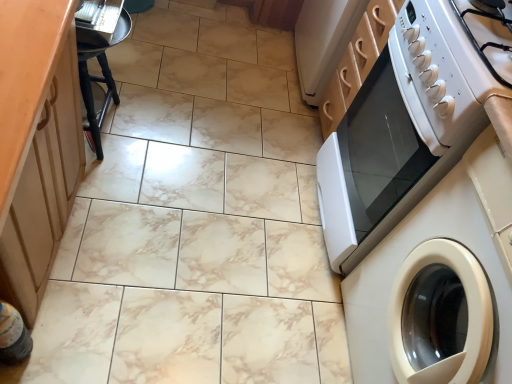
Question: Is white glossy gas stove at upper right oriented towards translucent plastic bottle at lower left?

Choices:
 (A) yes
 (B) no

Answer: (B)

Question: Is white glossy gas stove at upper right far from translucent plastic bottle at lower left?

Choices:
 (A) no
 (B) yes

Answer: (B)

Question: From a real-world perspective, is white glossy gas stove at upper right positioned over translucent plastic bottle at lower left based on gravity?

Choices:
 (A) yes
 (B) no

Answer: (A)

Question: Is white glossy gas stove at upper right further to the viewer compared to translucent plastic bottle at lower left?

Choices:
 (A) yes
 (B) no

Answer: (B)

Question: From the image's perspective, is white glossy gas stove at upper right beneath translucent plastic bottle at lower left?

Choices:
 (A) yes
 (B) no

Answer: (B)

Question: Is white glossy gas stove at upper right in front of translucent plastic bottle at lower left?

Choices:
 (A) no
 (B) yes

Answer: (B)

Question: Can you confirm if wooden cabinet at left is taller than white glossy washing machine at right?

Choices:
 (A) no
 (B) yes

Answer: (A)

Question: Can you confirm if wooden cabinet at left is bigger than white glossy washing machine at right?

Choices:
 (A) no
 (B) yes

Answer: (B)

Question: From a real-world perspective, is wooden cabinet at left beneath white glossy washing machine at right?

Choices:
 (A) yes
 (B) no

Answer: (A)

Question: From the image's perspective, is wooden cabinet at left above white glossy washing machine at right?

Choices:
 (A) no
 (B) yes

Answer: (B)

Question: Would you say white glossy washing machine at right is part of wooden cabinet at left's contents?

Choices:
 (A) yes
 (B) no

Answer: (B)

Question: Is wooden cabinet at left outside of white glossy washing machine at right?

Choices:
 (A) no
 (B) yes

Answer: (B)

Question: Are black wood stool at left and white glossy oven at right located far from each other?

Choices:
 (A) yes
 (B) no

Answer: (B)